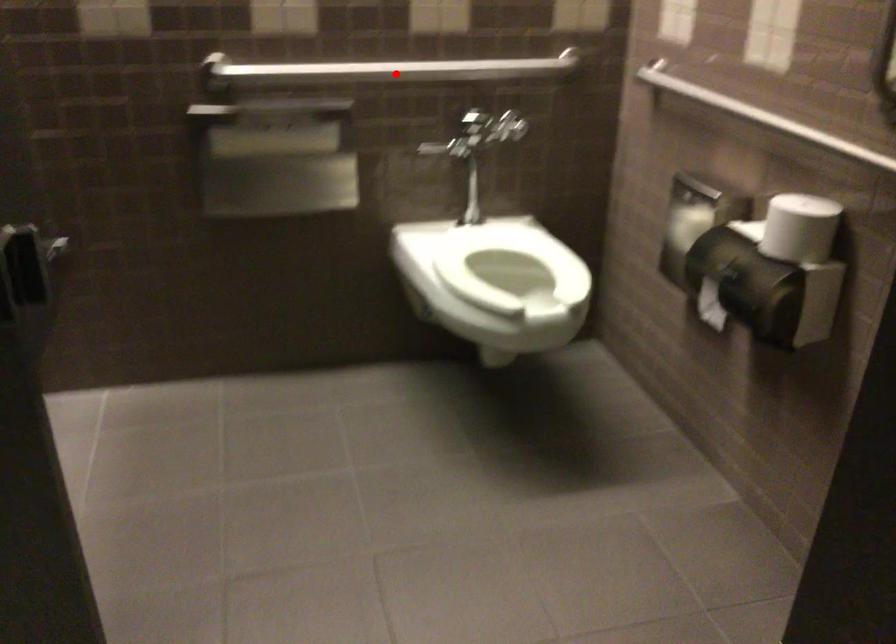
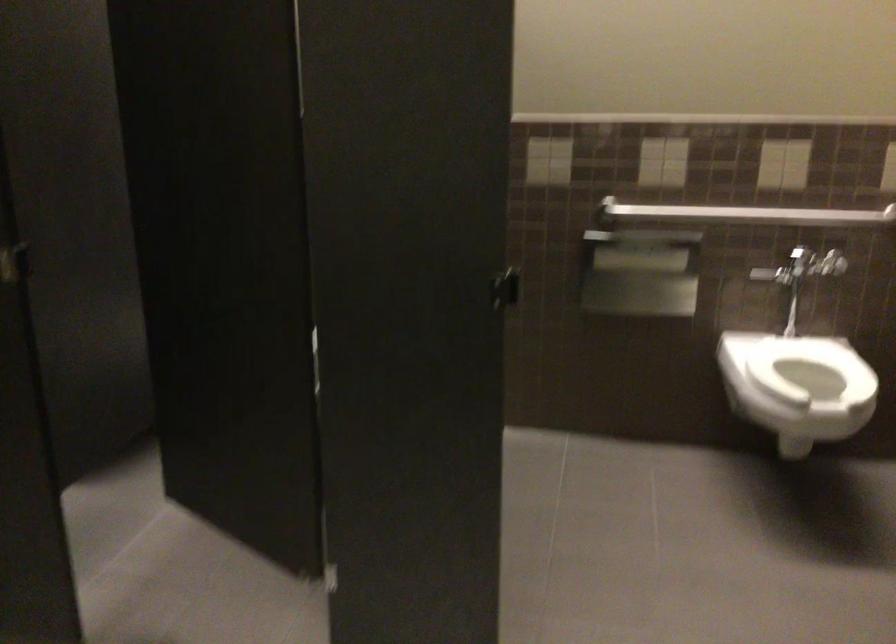
Question: A red point is marked in image1. In image2, is the corresponding 3D point closer to the camera or farther? Reply with the corresponding letter.

Choices:
 (A) The corresponding 3D point is closer.
 (B) The corresponding 3D point is farther.

Answer: (B)